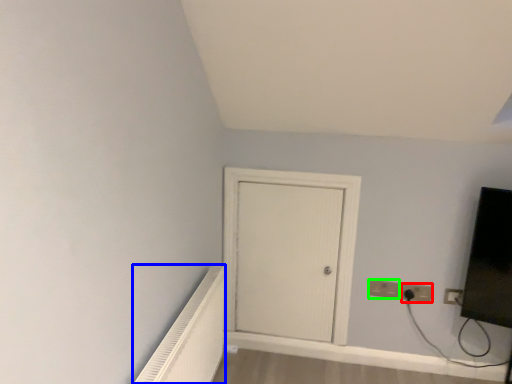
Question: Which is farther away from electric outlet (highlighted by a red box)? radiator (highlighted by a blue box) or electric outlet (highlighted by a green box)?

Choices:
 (A) radiator
 (B) electric outlet

Answer: (A)